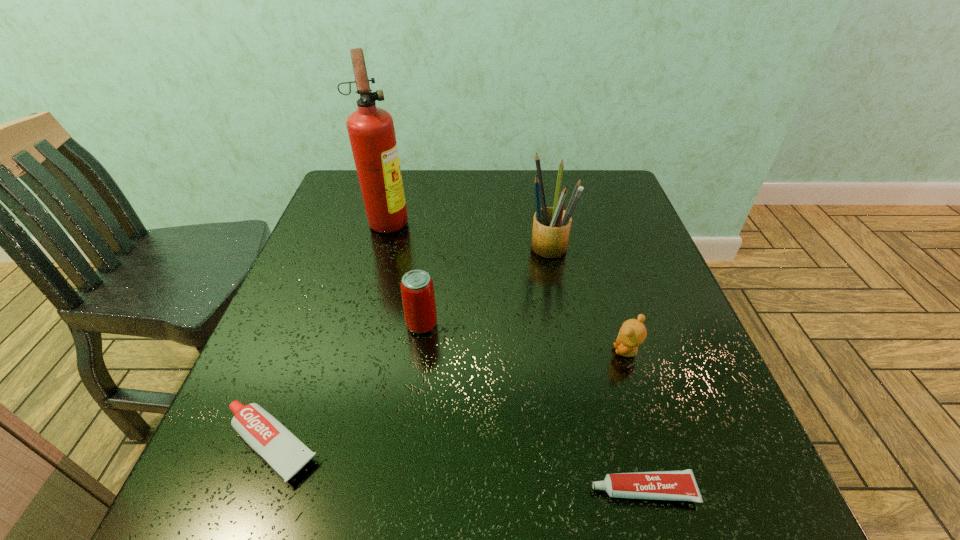
Identify the location of the tallest object. The width and height of the screenshot is (960, 540). (371, 131).

Locate an element on the screen. This screenshot has height=540, width=960. pencil box is located at coordinates (551, 225).

Identify the location of the third farthest object. (417, 290).

Where is `the third object from left to right`? Image resolution: width=960 pixels, height=540 pixels. the third object from left to right is located at coordinates (417, 290).

The height and width of the screenshot is (540, 960). Identify the location of teddy bear. (633, 332).

The width and height of the screenshot is (960, 540). What are the coordinates of `the fourth tallest object` in the screenshot? It's located at (633, 332).

You are a GUI agent. You are given a task and a screenshot of the screen. Output one action in this format:
    pyautogui.click(x=<x>, y=<y>)
    Task: Click on the second shortest object
    
    Given the screenshot: What is the action you would take?
    pyautogui.click(x=285, y=453)

I want to click on the left toothpaste, so click(x=285, y=453).

You are a GUI agent. You are given a task and a screenshot of the screen. Output one action in this format:
    pyautogui.click(x=<x>, y=<y>)
    Task: Click on the right toothpaste
    Image resolution: width=960 pixels, height=540 pixels.
    Given the screenshot: What is the action you would take?
    pyautogui.click(x=680, y=485)

Where is `the shorter toothpaste`? This screenshot has height=540, width=960. the shorter toothpaste is located at coordinates (680, 485).